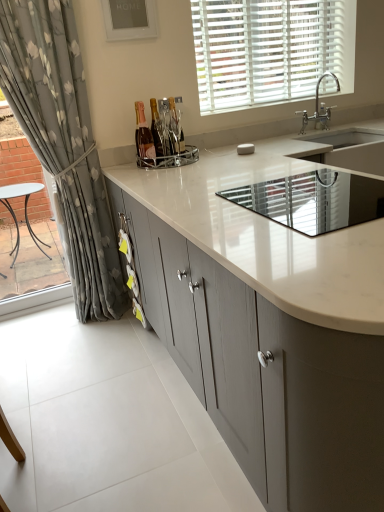
What do you see at coordinates (175, 129) in the screenshot?
I see `matte glass bottle at center, the 3th bottle from the left` at bounding box center [175, 129].

Measure the distance between white glossy sink at center and camera.

A distance of 1.13 meters exists between white glossy sink at center and camera.

The width and height of the screenshot is (384, 512). Describe the element at coordinates (313, 200) in the screenshot. I see `white glossy sink at center` at that location.

What do you see at coordinates (270, 50) in the screenshot? This screenshot has width=384, height=512. I see `white matte blinds at upper center` at bounding box center [270, 50].

Find the location of `black glass cooktop at center, the 1th appliance when ordered from right to left`. black glass cooktop at center, the 1th appliance when ordered from right to left is located at coordinates (313, 200).

The width and height of the screenshot is (384, 512). In order to click on matte glass bottle at center, the 3th bottle from the left in this screenshot , I will do `click(175, 129)`.

From the image's perspective, would you say floral fabric curtain at left is shown under white glossy sink at center?

Yes.

Which object is closer to the camera taking this photo, floral fabric curtain at left or white glossy sink at center?

floral fabric curtain at left is closer to the camera.

In terms of height, does floral fabric curtain at left look taller or shorter compared to white glossy sink at center?

Considering their sizes, floral fabric curtain at left has more height than white glossy sink at center.

From the picture: Is white glossy sink at center at the back of floral fabric curtain at left?

No, floral fabric curtain at left is not facing away from white glossy sink at center.

Considering the sizes of objects white glossy sink at center and matte glass bottle at center, which appears as the 2th bottle when viewed from the left, in the image provided, who is shorter, white glossy sink at center or matte glass bottle at center, which appears as the 2th bottle when viewed from the left,?

With less height is matte glass bottle at center, which appears as the 2th bottle when viewed from the left.

Does point (344, 177) lie behind point (157, 138)?

No, (344, 177) is in front of (157, 138).

Is white glossy sink at center closer to the viewer compared to matte glass bottle at center, which appears as the 2th bottle when viewed from the left?

Yes.

In the scene shown: From the image's perspective, is white glossy sink at center located beneath matte glass bottle at center, which appears as the 2th bottle when viewed from the left?

Yes.

Does chrome metallic wine rack at center, which ranks as the 1th appliance in left-to-right order, have a larger size compared to matte gray cabinets at center?

No.

From a real-world perspective, relative to matte gray cabinets at center, is chrome metallic wine rack at center, the 1th appliance from the top, vertically above or below?

In terms of real-world spatial position, chrome metallic wine rack at center, the 1th appliance from the top, is above matte gray cabinets at center.

What are the coordinates of `the 2nd appliance behind the matte gray cabinets at center, starting your count from the anchor` in the screenshot? It's located at (171, 159).

Considering the sizes of chrome metallic wine rack at center, which is the second appliance from bottom to top, and white matte blinds at upper center in the image, is chrome metallic wine rack at center, which is the second appliance from bottom to top, bigger or smaller than white matte blinds at upper center?

In the image, chrome metallic wine rack at center, which is the second appliance from bottom to top, appears to be smaller than white matte blinds at upper center.

Does chrome metallic wine rack at center, the 1th appliance from the top, contain white matte blinds at upper center?

No, white matte blinds at upper center is not surrounded by chrome metallic wine rack at center, the 1th appliance from the top.

Does chrome metallic wine rack at center, which is the second appliance from bottom to top, turn towards white matte blinds at upper center?

No, chrome metallic wine rack at center, which is the second appliance from bottom to top, does not turn towards white matte blinds at upper center.

Which point is more distant from viewer, (196, 159) or (203, 88)?

The point (203, 88) is farther from the camera.

Considering the relative sizes of matte glass bottle at center, which is the 1th bottle in left-to-right order, and matte glass bottle at center, the 3th bottle from the left, in the image provided, is matte glass bottle at center, which is the 1th bottle in left-to-right order, bigger than matte glass bottle at center, the 3th bottle from the left,?

Incorrect, matte glass bottle at center, which is the 1th bottle in left-to-right order, is not larger than matte glass bottle at center, the 3th bottle from the left.

Where is `bottle that is the 2nd one when counting leftward from the matte glass bottle at center, the 3th bottle from the left`? The image size is (384, 512). bottle that is the 2nd one when counting leftward from the matte glass bottle at center, the 3th bottle from the left is located at coordinates (144, 137).

From the image's perspective, who appears lower, matte glass bottle at center, which is the 1th bottle in left-to-right order, or matte glass bottle at center, the 3th bottle from the left?

matte glass bottle at center, which is the 1th bottle in left-to-right order, is shown below in the image.

Is matte glass bottle at center, which is the 1th bottle in left-to-right order, directly adjacent to matte glass bottle at center, the 3th bottle from the left?

No, matte glass bottle at center, which is the 1th bottle in left-to-right order, is not next to matte glass bottle at center, the 3th bottle from the left.

Is matte glass bottle at center, the 3th bottle from the left, not close to white matte blinds at upper center?

That's not correct — matte glass bottle at center, the 3th bottle from the left, is a little close to white matte blinds at upper center.

Is white matte blinds at upper center at the back of matte glass bottle at center, positioned as the first bottle in right-to-left order?

No.

Does matte glass bottle at center, the 3th bottle from the left, have a lesser height compared to white matte blinds at upper center?

Yes.

Between matte glass bottle at center, the 3th bottle from the left, and white matte blinds at upper center, which one appears on the left side from the viewer's perspective?

matte glass bottle at center, the 3th bottle from the left.

Which of these two, floral fabric curtain at left or chrome metallic wine rack at center, which ranks as the 1th appliance in left-to-right order, stands shorter?

With less height is chrome metallic wine rack at center, which ranks as the 1th appliance in left-to-right order.

Where is `appliance that is the 1st object to the right of the floral fabric curtain at left, starting at the anchor`? Image resolution: width=384 pixels, height=512 pixels. appliance that is the 1st object to the right of the floral fabric curtain at left, starting at the anchor is located at coordinates (171, 159).

In the scene shown: From the image's perspective, is floral fabric curtain at left above or below chrome metallic wine rack at center, the second appliance viewed from the right?

floral fabric curtain at left is situated lower than chrome metallic wine rack at center, the second appliance viewed from the right, in the image.

Identify the location of curtain below the white glossy sink at center (from the image's perspective). Image resolution: width=384 pixels, height=512 pixels. (63, 142).

Where is `sink lying in front of the matte glass bottle at center, positioned as the 2th bottle in right-to-left order`? The height and width of the screenshot is (512, 384). sink lying in front of the matte glass bottle at center, positioned as the 2th bottle in right-to-left order is located at coordinates (313, 200).

From the image, which object appears to be farther from white glossy sink at center, floral fabric curtain at left or matte glass bottle at center, which appears as the 2th bottle when viewed from the left?

floral fabric curtain at left is positioned further to the anchor white glossy sink at center.

When comparing their distances from silver metallic faucet at upper right, does white matte blinds at upper center or white glossy sink at center seem further?

Among the two, white glossy sink at center is located further to silver metallic faucet at upper right.

Which object lies further to the anchor point white matte blinds at upper center, white glossy sink at center or floral fabric curtain at left?

white glossy sink at center is further to white matte blinds at upper center.

Based on their spatial positions, is white glossy sink at center or matte glass bottle at center, the 3th bottle from the right, further from black glass cooktop at center, the 1th appliance from the front?

matte glass bottle at center, the 3th bottle from the right.

Based on the photo, based on their spatial positions, is matte glass bottle at center, the 3th bottle from the left, or black glass cooktop at center, the 1th appliance when ordered from right to left, further from floral fabric curtain at left?

The object further to floral fabric curtain at left is black glass cooktop at center, the 1th appliance when ordered from right to left.

From the image, which object appears to be nearer to matte glass bottle at center, which appears as the 2th bottle when viewed from the left, white matte blinds at upper center or floral fabric curtain at left?

Based on the image, floral fabric curtain at left appears to be nearer to matte glass bottle at center, which appears as the 2th bottle when viewed from the left.

From the image, which object appears to be nearer to floral fabric curtain at left, matte gray cabinets at center or black glass cooktop at center, positioned as the first appliance in bottom-to-top order?

matte gray cabinets at center is positioned closer to the anchor floral fabric curtain at left.

Estimate the real-world distances between objects in this image. Which object is further from silver metallic faucet at upper right, floral fabric curtain at left or matte glass bottle at center, the 3th bottle from the left?

Among the two, floral fabric curtain at left is located further to silver metallic faucet at upper right.

The width and height of the screenshot is (384, 512). Identify the location of curtain positioned between matte gray cabinets at center and silver metallic faucet at upper right from near to far. (63, 142).

Identify the location of appliance positioned between black glass cooktop at center, acting as the second appliance starting from the back, and matte glass bottle at center, positioned as the first bottle in right-to-left order, from near to far. (171, 159).

You are a GUI agent. You are given a task and a screenshot of the screen. Output one action in this format:
    pyautogui.click(x=<x>, y=<y>)
    Task: Click on the tap between matte glass bottle at center, which appears as the 2th bottle when viewed from the left, and white glossy sink at center
    
    Given the screenshot: What is the action you would take?
    pyautogui.click(x=318, y=106)

The width and height of the screenshot is (384, 512). In order to click on bottle located between floral fabric curtain at left and matte glass bottle at center, positioned as the 2th bottle in right-to-left order, in the left-right direction in this screenshot , I will do `click(144, 137)`.